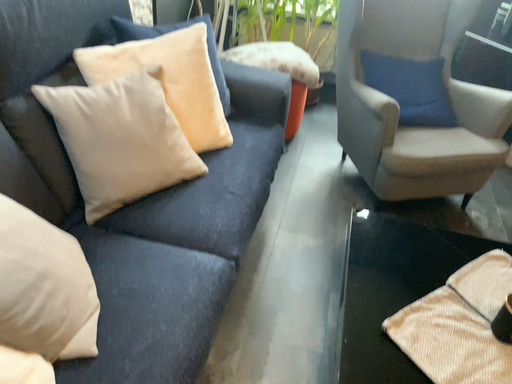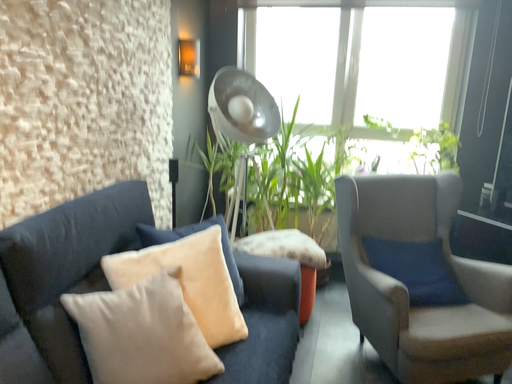
Question: Which way did the camera rotate in the video?

Choices:
 (A) rotated upward
 (B) rotated downward

Answer: (A)